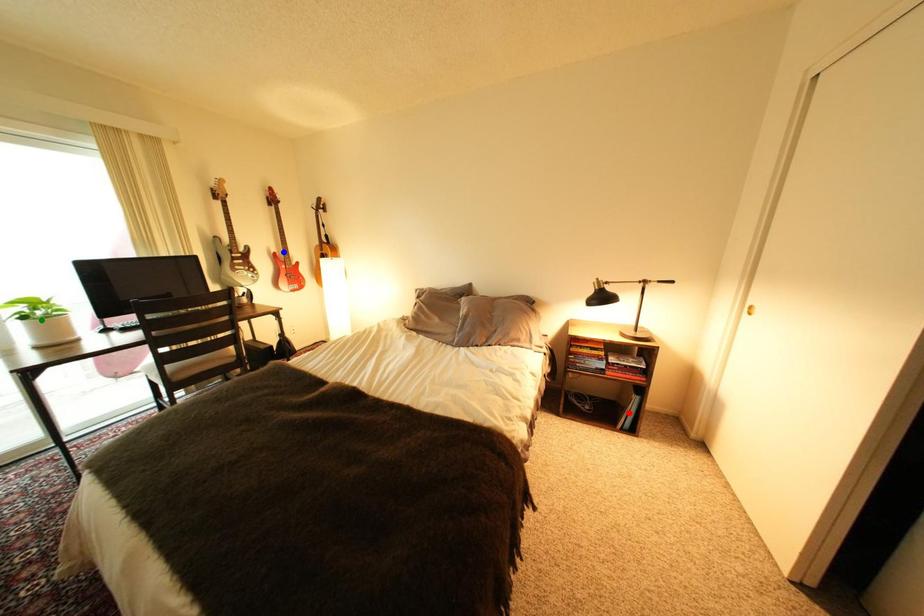
Order these from nearest to farthest:
red point
green point
blue point

1. green point
2. red point
3. blue point